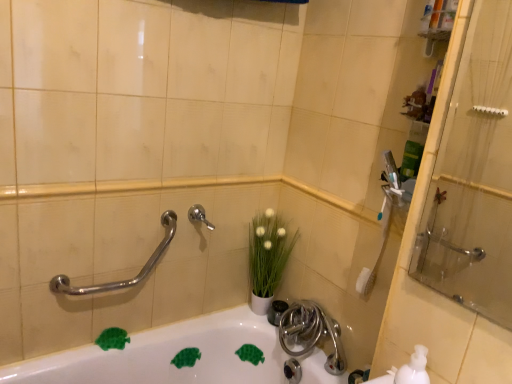
Identify the location of free spot below polished chrome grab bar at upper left (from a real-world perspective). This screenshot has width=512, height=384. (113, 342).